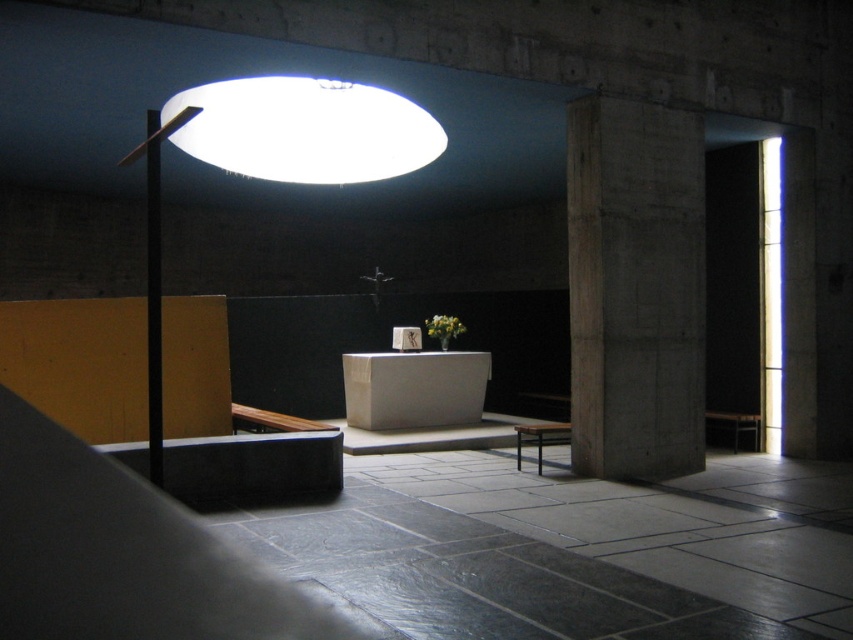
Based on the photo, you are an interior designer planning to install a new lighting fixture in this minimalist chapel. The concrete pillar at center and the matte black floor lamp at upper center are already present. Which object is shorter?

The concrete pillar at center is shorter than the matte black floor lamp at upper center according to the description.

From the picture: You are standing at the entrance of the minimalist interior space. You need to place a new decorative item exactly at the center of the room. Is the concrete pillar at center already occupying that spot?

The concrete pillar at center is located at point (635, 288), which is not exactly the center of the room. Therefore, you can place the decorative item at the true center without overlapping the concrete pillar at center.